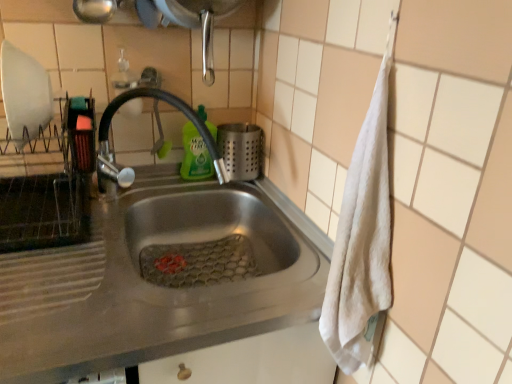
The image size is (512, 384). What are the coordinates of `free space to the left of green liquid at sink` in the screenshot? It's located at (145, 188).